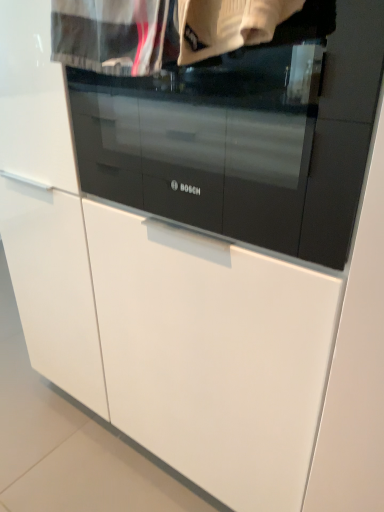
Question: Could you tell me if black glass oven at center is turned towards white cotton shirt at upper center, the first clothing positioned from the left?

Choices:
 (A) yes
 (B) no

Answer: (A)

Question: Is black glass oven at center shorter than white cotton shirt at upper center, the 2th clothing positioned from the right?

Choices:
 (A) yes
 (B) no

Answer: (B)

Question: Considering the relative sizes of black glass oven at center and white cotton shirt at upper center, the first clothing positioned from the left, in the image provided, is black glass oven at center wider than white cotton shirt at upper center, the first clothing positioned from the left,?

Choices:
 (A) yes
 (B) no

Answer: (A)

Question: Is white cotton shirt at upper center, the first clothing positioned from the left, at the back of black glass oven at center?

Choices:
 (A) yes
 (B) no

Answer: (B)

Question: Is black glass oven at center far away from white cotton shirt at upper center, the first clothing positioned from the left?

Choices:
 (A) no
 (B) yes

Answer: (A)

Question: Looking at the image, does white cotton shirt at upper center, the first clothing positioned from the left, seem bigger or smaller compared to black glass oven at center?

Choices:
 (A) big
 (B) small

Answer: (B)

Question: From a real-world perspective, is white cotton shirt at upper center, the 2th clothing positioned from the right, above or below black glass oven at center?

Choices:
 (A) below
 (B) above

Answer: (B)

Question: In the image, is white cotton shirt at upper center, the first clothing positioned from the left, positioned in front of or behind black glass oven at center?

Choices:
 (A) behind
 (B) front

Answer: (A)

Question: Is white cotton shirt at upper center, the first clothing positioned from the left, inside or outside of black glass oven at center?

Choices:
 (A) outside
 (B) inside

Answer: (A)

Question: Would you say black glass oven at center is inside or outside white knitted sweater at upper center, positioned as the 2th clothing in left-to-right order?

Choices:
 (A) inside
 (B) outside

Answer: (B)

Question: Is point (286, 97) positioned closer to the camera than point (210, 27)?

Choices:
 (A) farther
 (B) closer

Answer: (A)

Question: Considering the positions of black glass oven at center and white knitted sweater at upper center, positioned as the 2th clothing in left-to-right order, in the image, is black glass oven at center taller or shorter than white knitted sweater at upper center, positioned as the 2th clothing in left-to-right order,?

Choices:
 (A) short
 (B) tall

Answer: (B)

Question: From the image's perspective, is black glass oven at center located above or below white knitted sweater at upper center, positioned as the 1th clothing in right-to-left order?

Choices:
 (A) below
 (B) above

Answer: (A)

Question: Is white knitted sweater at upper center, positioned as the 1th clothing in right-to-left order, inside or outside of black glass oven at center?

Choices:
 (A) inside
 (B) outside

Answer: (B)

Question: Is white knitted sweater at upper center, positioned as the 2th clothing in left-to-right order, wider or thinner than black glass oven at center?

Choices:
 (A) wide
 (B) thin

Answer: (B)